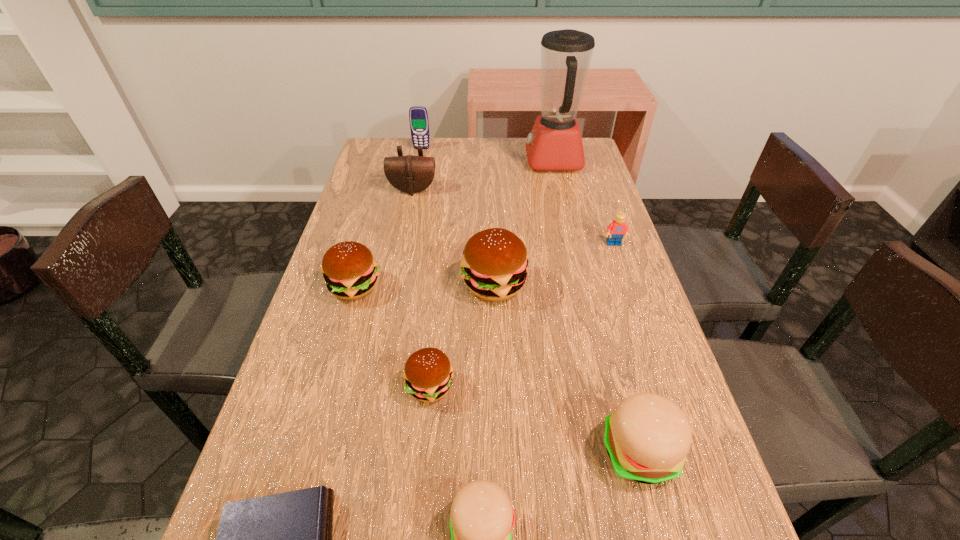
Identify the location of vacant space located on the left of the second nearest hamburger. (499, 451).

I want to click on vacant space located on the face of the fourth farthest object, so click(x=635, y=305).

The width and height of the screenshot is (960, 540). Identify the location of vacant point located 0.370m on the right of the second hamburger from left to right. click(643, 386).

At what (x,y) coordinates should I click in order to perform the action: click on blender that is at the far edge. Please return your answer as a coordinate pair (x, y). This screenshot has height=540, width=960. Looking at the image, I should click on pos(555,144).

This screenshot has width=960, height=540. Find the location of `cellular telephone that is at the far edge`. cellular telephone that is at the far edge is located at coordinates (418, 116).

This screenshot has height=540, width=960. I want to click on cellular telephone at the left edge, so click(x=418, y=116).

The height and width of the screenshot is (540, 960). What are the coordinates of `pouch at the left edge` in the screenshot? It's located at (410, 174).

I want to click on hamburger that is at the left edge, so click(x=350, y=271).

What are the coordinates of `blender that is at the right edge` in the screenshot? It's located at (555, 144).

I want to click on hamburger positioned at the right edge, so click(647, 438).